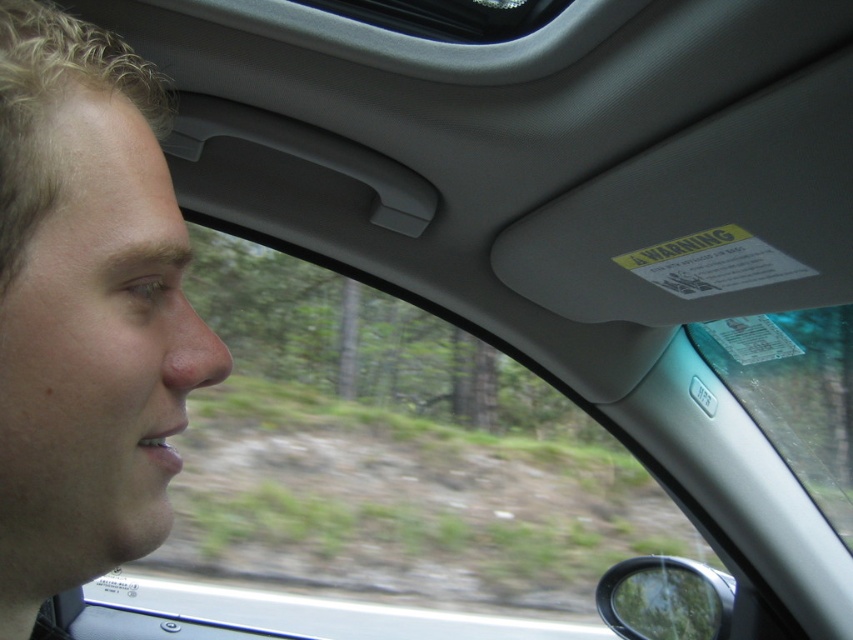
Question: Which point is farther to the camera?

Choices:
 (A) pyautogui.click(x=102, y=353)
 (B) pyautogui.click(x=726, y=385)

Answer: (B)

Question: Can you confirm if pale skin face at left is positioned to the right of transparent plastic sign at upper center?

Choices:
 (A) no
 (B) yes

Answer: (A)

Question: Does pale skin face at left appear on the right side of transparent plastic sign at upper center?

Choices:
 (A) yes
 (B) no

Answer: (B)

Question: Can you confirm if pale skin face at left is bigger than transparent plastic sign at upper center?

Choices:
 (A) yes
 (B) no

Answer: (B)